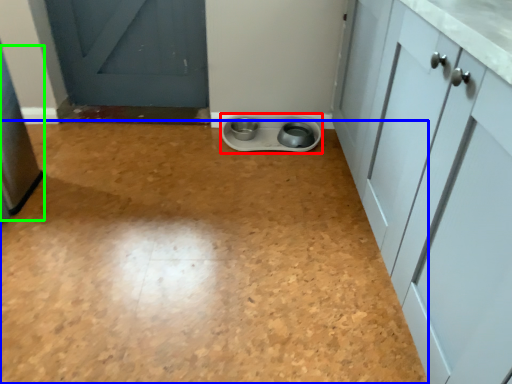
Question: Which object is positioned farthest from appliance (highlighted by a red box)? Select from plain (highlighted by a blue box) and appliance (highlighted by a green box).

Choices:
 (A) plain
 (B) appliance

Answer: (B)